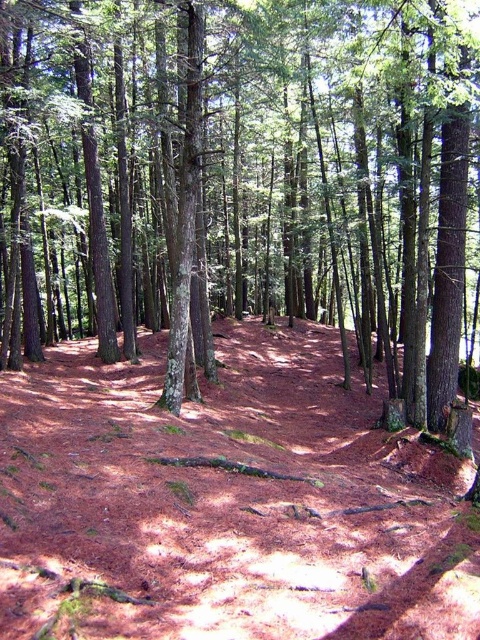
You are a hiker who wants to take a photo of the brown rough tree at center from a distance. If your camera has a maximum focus range of 20 feet, will you be able to capture the tree clearly?

The brown rough tree at center is 21.67 feet away from the viewer, which exceeds the camera maximum focus range of 20 feet. Therefore, the camera cannot focus on the tree clearly.

You are hiking along the brown dirt trail at center and want to take a photo of the brown rough tree at center. In which direction should you move to frame the tree in your camera?

The brown rough tree at center is to the right of the brown dirt trail at center, so you should move to the right side of the trail to frame the tree in your camera.

You are standing in the forest and want to locate the brown rough tree at center. Based on the coordinates provided, where should you look relative to your current position?

The brown rough tree at center is located at coordinates point (240, 180), which means it is positioned to the left and slightly below your current viewpoint.